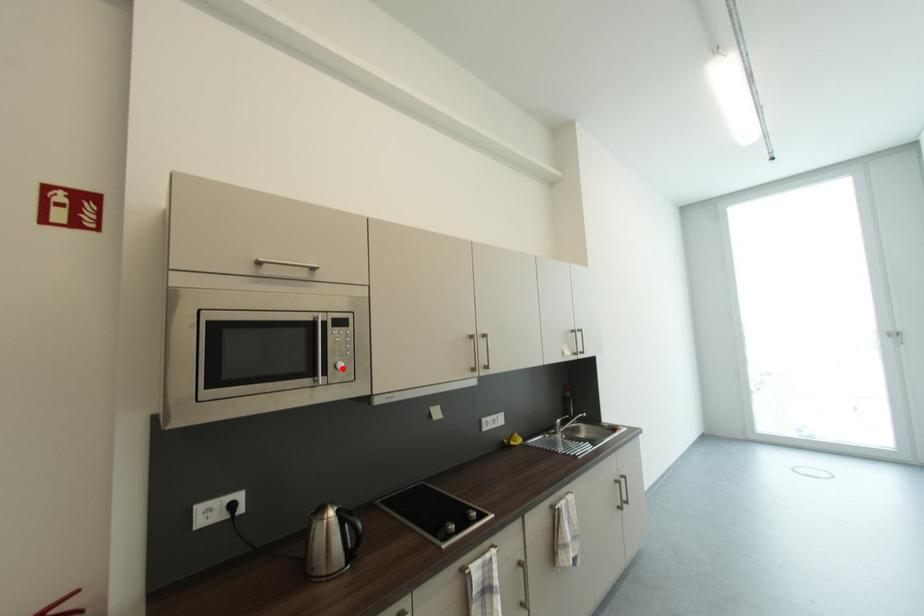
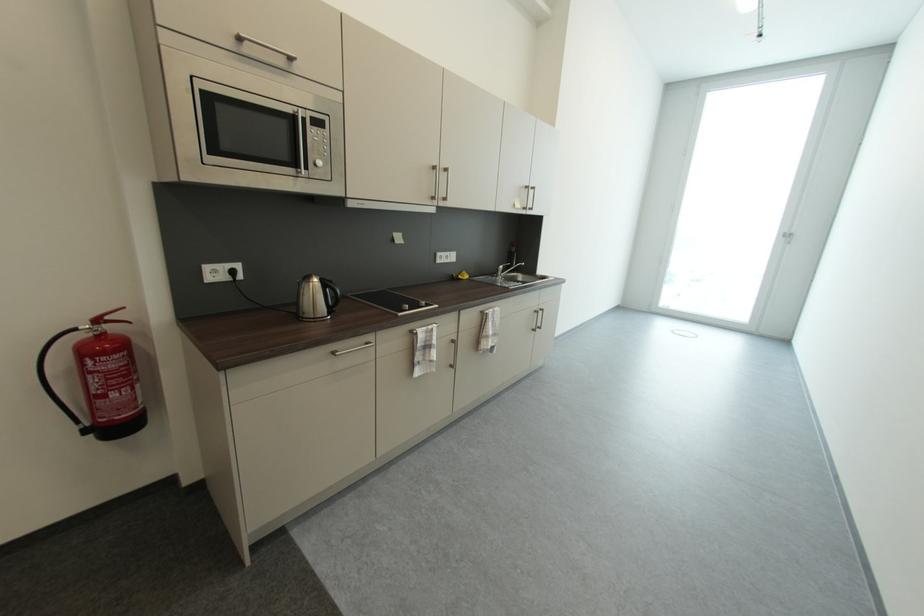
In the second image, find the point that corresponds to the highlighted location in the first image.

(322, 166)